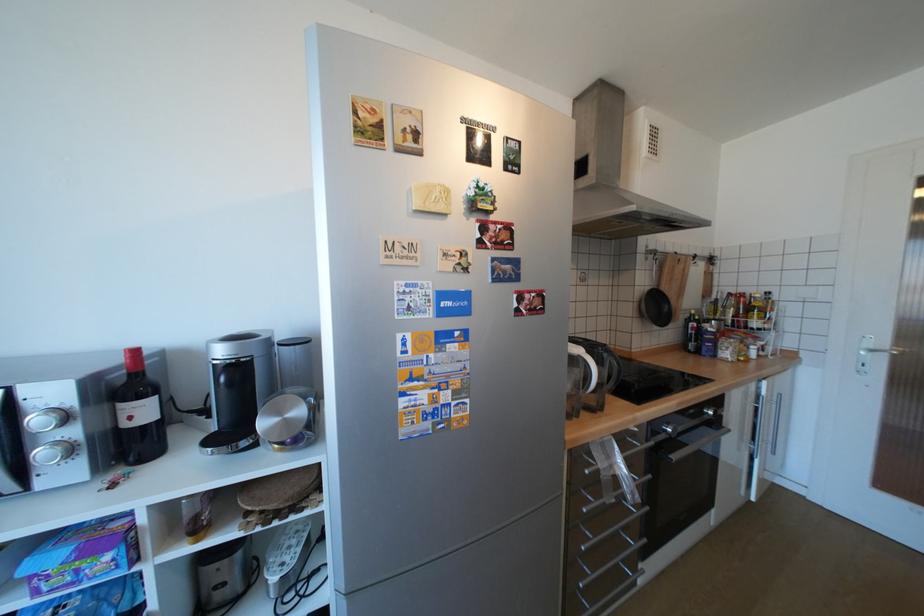
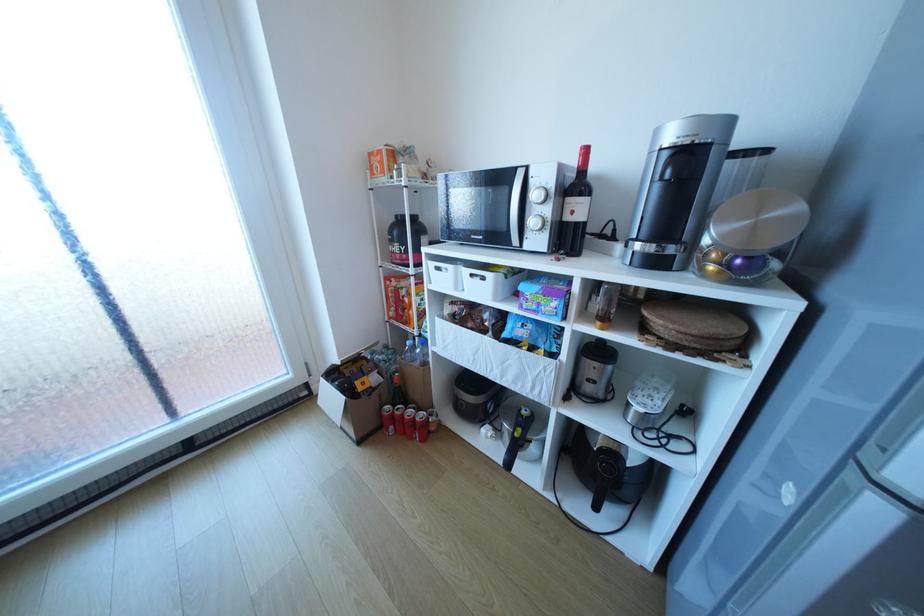
Locate, in the second image, the point that corresponds to (x=46, y=419) in the first image.

(542, 195)